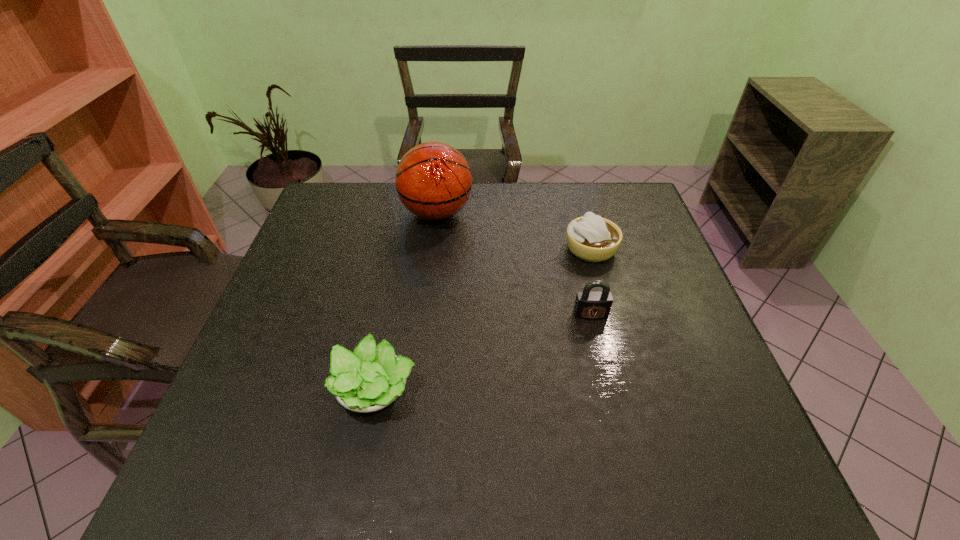
Where is `basketball`? basketball is located at coordinates (433, 180).

Find the location of a particular element. the second nearest object is located at coordinates (591, 305).

Locate an element on the screen. The width and height of the screenshot is (960, 540). whipped cream is located at coordinates (591, 238).

Identify the location of the nearest object. This screenshot has height=540, width=960. (369, 379).

Identify the location of lettuce. (369, 379).

The height and width of the screenshot is (540, 960). Identify the location of free space located 0.050m on the side with spill of the basketball. (489, 213).

You are a GUI agent. You are given a task and a screenshot of the screen. Output one action in this format:
    pyautogui.click(x=<x>, y=<y>)
    Task: Click on the vacant point located on the front of the third farthest object near the keyhole
    The height and width of the screenshot is (540, 960).
    Given the screenshot: What is the action you would take?
    pyautogui.click(x=602, y=362)

Locate an element on the screen. This screenshot has width=960, height=540. vacant space located 0.080m on the back of the whipped cream is located at coordinates (582, 217).

The width and height of the screenshot is (960, 540). Identify the location of vacant space situated on the back of the nearest object. coord(394,300).

Locate an element on the screen. Image resolution: width=960 pixels, height=540 pixels. object present at the far edge is located at coordinates (433, 180).